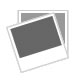
Where is `slanted picture`? The width and height of the screenshot is (80, 80). slanted picture is located at coordinates (29, 21), (43, 55).